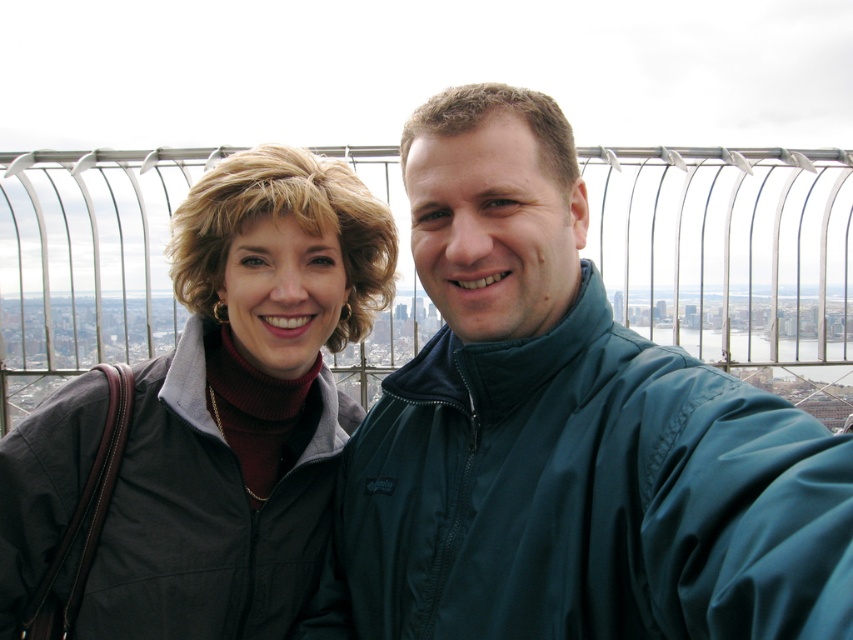
You are a fashion designer observing two jackets in an image. The teal matte jacket at center and the matte black jacket at left are part of the scene. Which jacket appears taller when viewed from the observer perspective?

The teal matte jacket at center appears taller than the matte black jacket at left.

You are a photographer trying to capture a photo of the two jackets in the scene. Since you want to ensure both jackets are visible in the frame, can you determine if the teal matte jacket at center and the matte black jacket at left are positioned side by side from your perspective?

The teal matte jacket at center is to the right of the matte black jacket at left, so they are positioned side by side from your perspective.